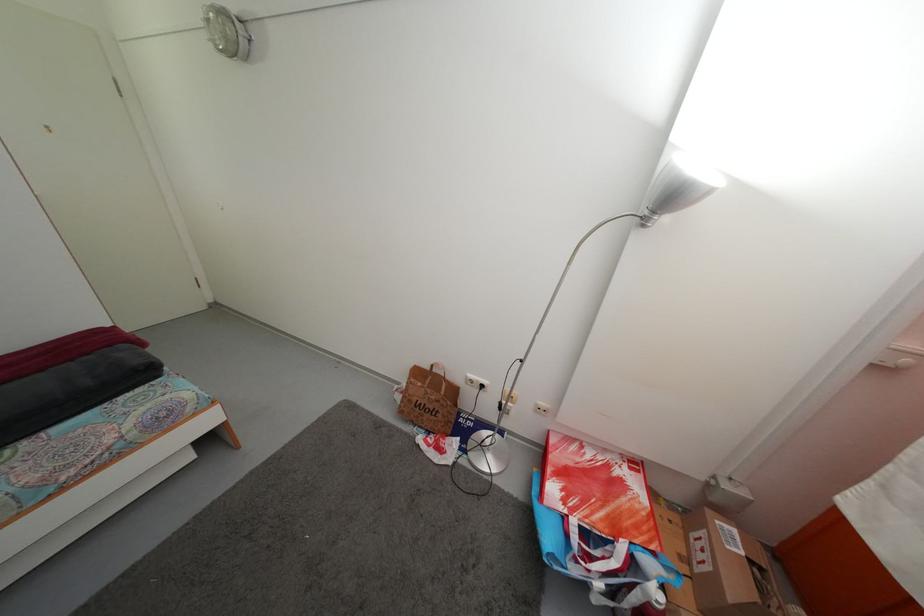
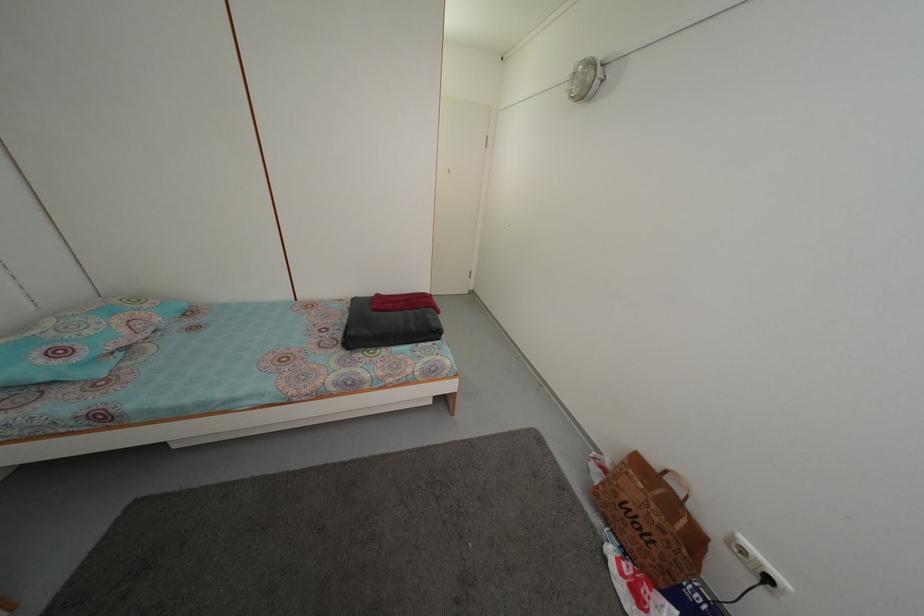
Find the pixel in the second image that matches (47,378) in the first image.

(407, 317)